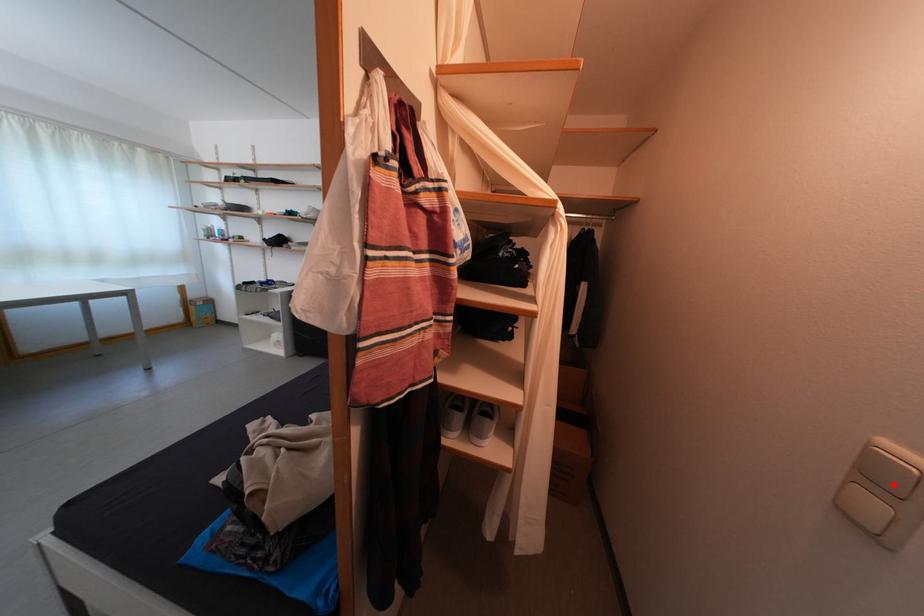
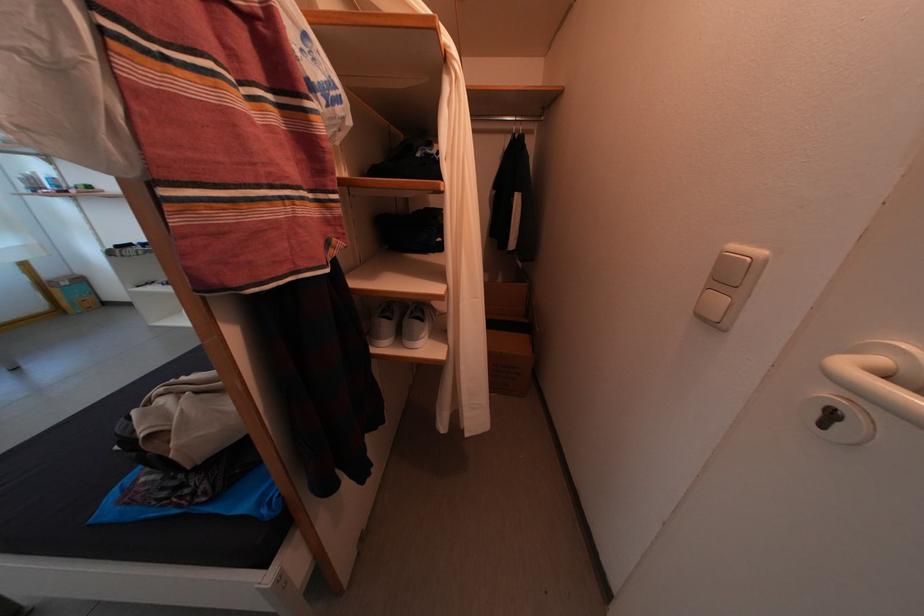
Where in the second image is the point corresponding to the highlighted location from the first image?

(739, 282)